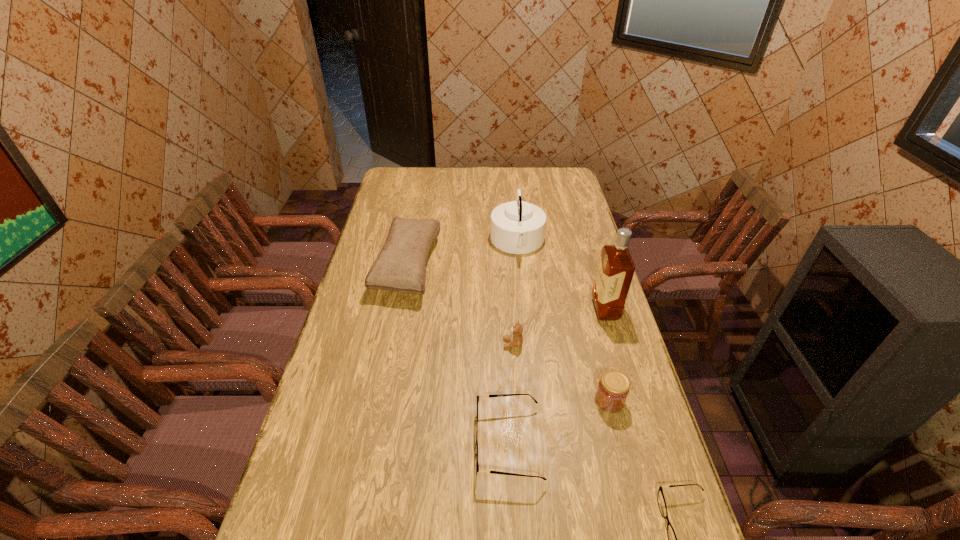
In order to click on vacant space in between the liquor and the kettle in this screenshot , I will do `click(562, 276)`.

This screenshot has height=540, width=960. Identify the location of free space between the leftmost object and the sixth shortest object. (463, 254).

Identify the location of empty location between the tallest object and the kettle. (562, 276).

Where is `free space that is in between the left spectacles and the jam`? The image size is (960, 540). free space that is in between the left spectacles and the jam is located at coordinates (559, 422).

Find the location of a particular element. The height and width of the screenshot is (540, 960). empty space between the jam and the fourth farthest object is located at coordinates (561, 372).

Locate an element on the screen. vacant region between the liquor and the sixth tallest object is located at coordinates (557, 376).

Where is `unoccupied area between the jam and the second tallest object`? unoccupied area between the jam and the second tallest object is located at coordinates (564, 321).

Where is `free space between the leftmost object and the kettle`? free space between the leftmost object and the kettle is located at coordinates (463, 254).

Find the location of a particular element. The width and height of the screenshot is (960, 540). the fourth closest object relative to the jam is located at coordinates (616, 268).

Select which object appears as the fourth closest to the fourth farthest object. Please provide its 2D coordinates. Your answer should be formatted as a tuple, i.e. [(x, y)], where the tuple contains the x and y coordinates of a point satisfying the conditions above.

[(400, 266)]